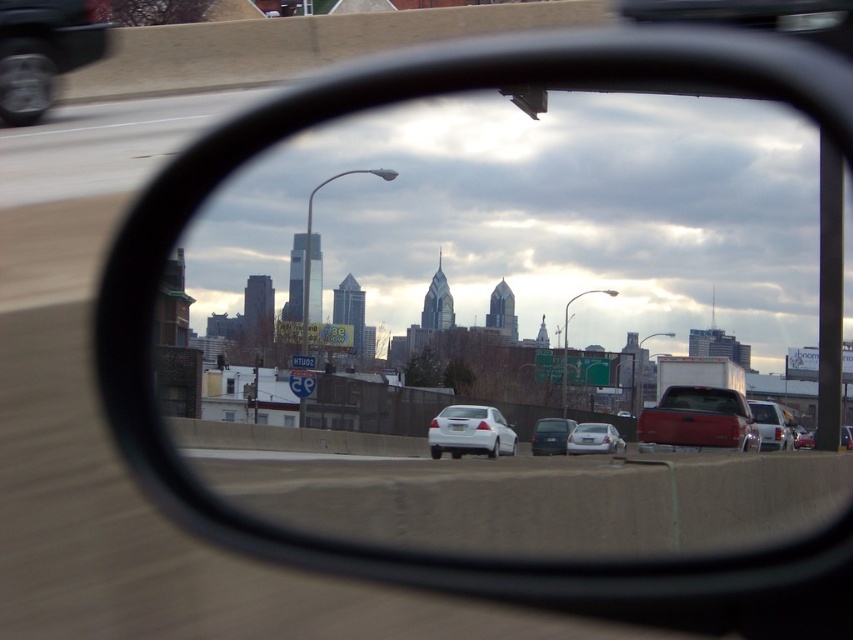
Looking at this image, who is taller, matte red truck at center or satin silver sedan at center?

Standing taller between the two is satin silver sedan at center.

Measure the distance between matte red truck at center and satin silver sedan at center.

matte red truck at center and satin silver sedan at center are 47.86 feet apart from each other.

Between point (728, 410) and point (607, 426), which one is positioned behind?

The point (607, 426) is behind.

The image size is (853, 640). I want to click on matte red truck at center, so click(701, 401).

Between point (432, 458) and point (601, 426), which one is positioned in front?

Positioned in front is point (432, 458).

Is white glossy sedan at center positioned before satin silver sedan at center?

Yes.

Find the location of `white glossy sedan at center`. white glossy sedan at center is located at coordinates (469, 433).

At what (x,y) coordinates should I click in order to perform the action: click on white glossy sedan at center. Please return your answer as a coordinate pair (x, y). Looking at the image, I should click on (469, 433).

Can you confirm if clear glass mirror at center is positioned to the right of white glossy sedan at center?

No, clear glass mirror at center is not to the right of white glossy sedan at center.

Which is more to the right, clear glass mirror at center or white glossy sedan at center?

white glossy sedan at center is more to the right.

Where is `clear glass mirror at center`? This screenshot has height=640, width=853. clear glass mirror at center is located at coordinates (515, 259).